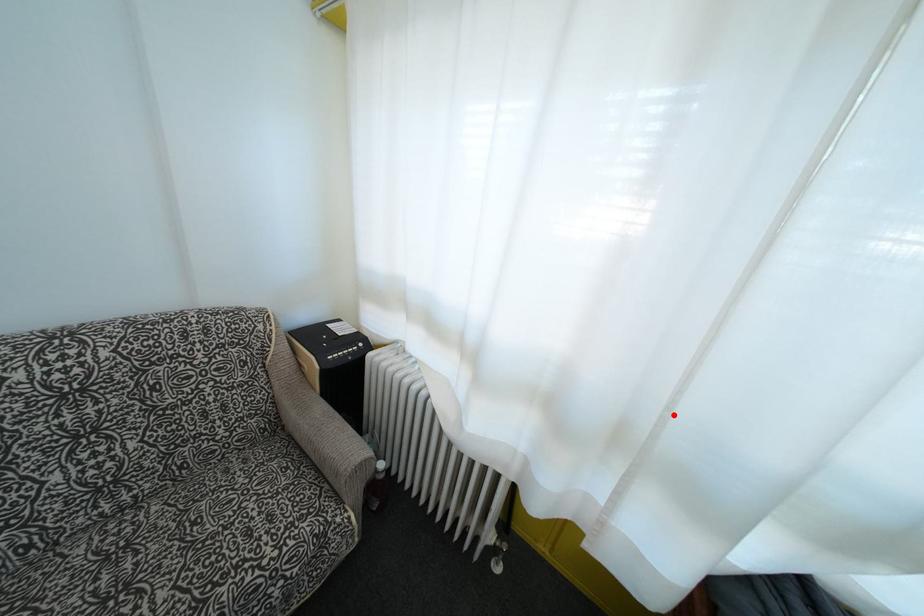
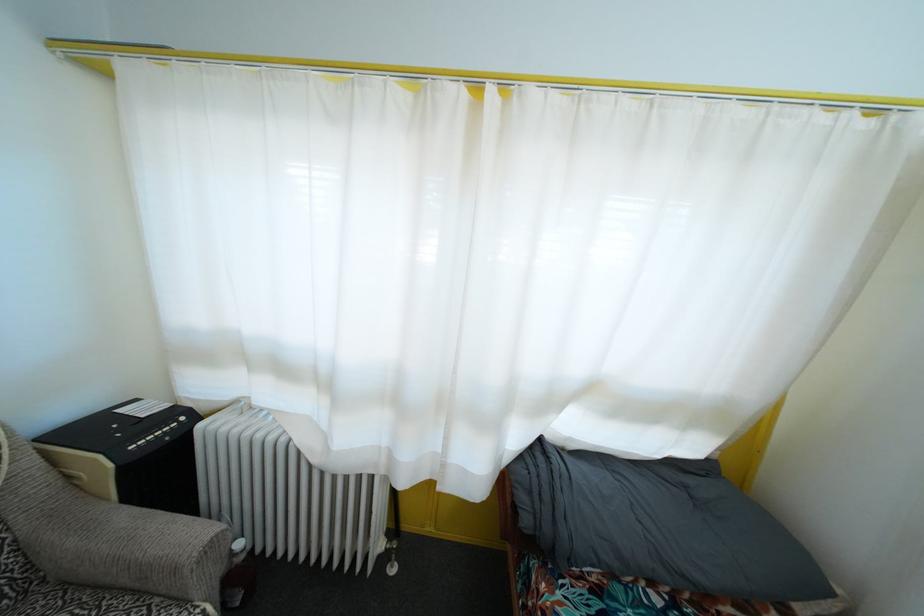
Find the pixel in the second image that matches the highlighted location in the first image.

(457, 379)